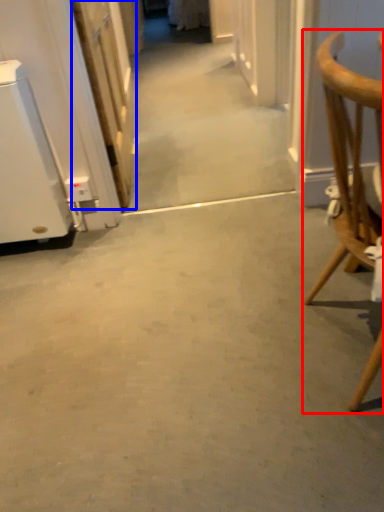
Question: Which of the following is the closest to the observer, chair (highlighted by a red box) or door (highlighted by a blue box)?

Choices:
 (A) chair
 (B) door

Answer: (A)